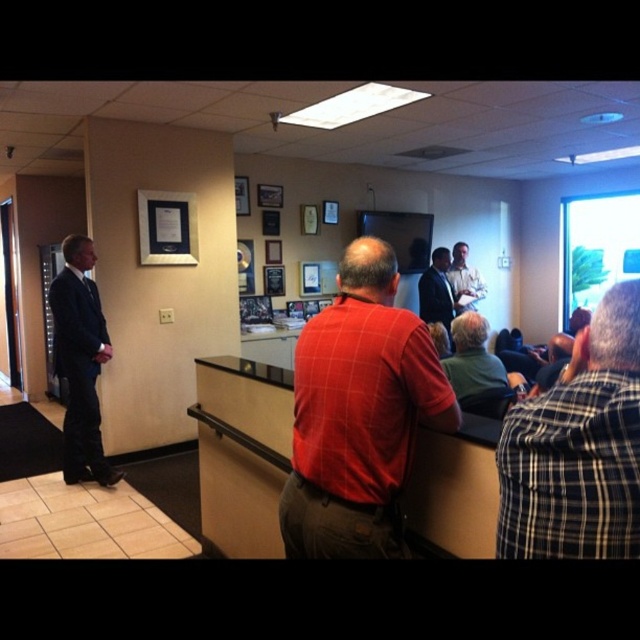
Question: Can you confirm if matte black suit at left is wider than matte black shirt at center?

Choices:
 (A) yes
 (B) no

Answer: (B)

Question: Which point is closer to the camera taking this photo?

Choices:
 (A) (333, 314)
 (B) (465, 291)

Answer: (A)

Question: Does red plaid shirt at center have a greater width compared to green fabric shirt at center?

Choices:
 (A) no
 (B) yes

Answer: (B)

Question: Which point appears farthest from the camera in this image?

Choices:
 (A) (547, 525)
 (B) (81, 472)
 (C) (419, 282)

Answer: (C)

Question: Is matte black suit at left positioned before matte black suit at center?

Choices:
 (A) yes
 (B) no

Answer: (A)

Question: Which object appears farthest from the camera in this image?

Choices:
 (A) blue plaid shirt at right
 (B) matte black suit at left
 (C) green fabric shirt at center
 (D) red plaid shirt at center

Answer: (B)